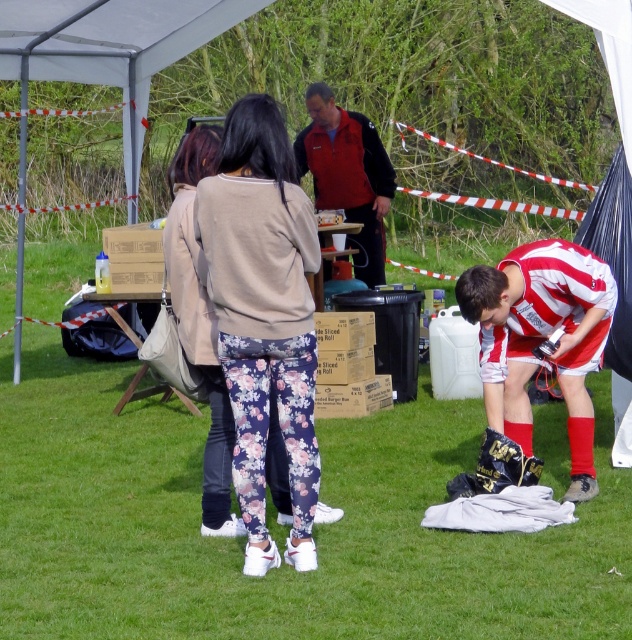
Question: Which object appears closest to the camera in this image?

Choices:
 (A) striped jersey at lower right
 (B) green grass at lower center

Answer: (B)

Question: Does floral leggings at center come behind red jacket at center?

Choices:
 (A) no
 (B) yes

Answer: (A)

Question: Which point is farther to the camera?

Choices:
 (A) green grass at lower center
 (B) striped jersey at lower right

Answer: (B)

Question: Is green grass at lower center closer to camera compared to red jacket at center?

Choices:
 (A) no
 (B) yes

Answer: (B)

Question: Is green grass at lower center below striped jersey at lower right?

Choices:
 (A) yes
 (B) no

Answer: (A)

Question: Which point is farther to the camera?

Choices:
 (A) (288, 336)
 (B) (356, 164)
 (C) (204, 566)

Answer: (B)